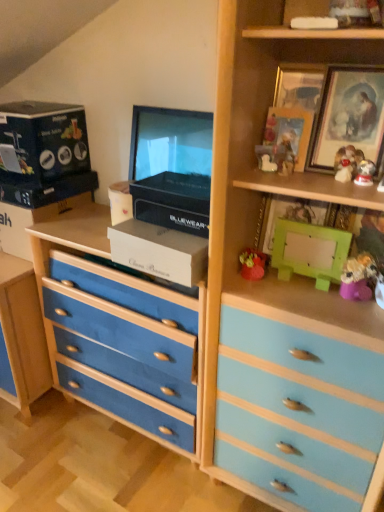
Question: From a real-world perspective, is matte black box at upper left, the fourth box when ordered from right to left, on top of green matte box at upper right, which is counted as the first box, starting from the right?

Choices:
 (A) no
 (B) yes

Answer: (B)

Question: Is matte black box at upper left, the fourth box when ordered from right to left, bigger than green matte box at upper right, which is counted as the fifth box, starting from the left?

Choices:
 (A) yes
 (B) no

Answer: (A)

Question: Is matte black box at upper left, the fourth box when ordered from right to left, next to green matte box at upper right, which is counted as the fifth box, starting from the left, and touching it?

Choices:
 (A) yes
 (B) no

Answer: (B)

Question: Can we say matte black box at upper left, the fourth box when ordered from right to left, lies outside green matte box at upper right, which is counted as the fifth box, starting from the left?

Choices:
 (A) yes
 (B) no

Answer: (A)

Question: Is matte black box at upper left, the fourth box when ordered from right to left, further to camera compared to green matte box at upper right, which is counted as the fifth box, starting from the left?

Choices:
 (A) no
 (B) yes

Answer: (B)

Question: Considering the relative positions of white glossy figurine at upper right, the 2th toy from the left, and wooden picture frame at upper right, which ranks as the second picture frame in right-to-left order, in the image provided, is white glossy figurine at upper right, the 2th toy from the left, to the left or to the right of wooden picture frame at upper right, which ranks as the second picture frame in right-to-left order,?

Choices:
 (A) left
 (B) right

Answer: (B)

Question: From a real-world perspective, is white glossy figurine at upper right, the 2th toy from the left, physically located above or below wooden picture frame at upper right, which ranks as the second picture frame in right-to-left order?

Choices:
 (A) below
 (B) above

Answer: (A)

Question: From the image's perspective, is white glossy figurine at upper right, which is the 1th toy in top-to-bottom order, above or below wooden picture frame at upper right, which is the second picture frame in left-to-right order?

Choices:
 (A) above
 (B) below

Answer: (B)

Question: Is point (342, 166) closer or farther from the camera than point (278, 97)?

Choices:
 (A) farther
 (B) closer

Answer: (B)

Question: Visually, is fuzzy yellow toy at right, positioned as the first toy in right-to-left order, positioned to the left or to the right of wooden framed picture at upper right, the 3th picture frame viewed from the left?

Choices:
 (A) right
 (B) left

Answer: (A)

Question: From a real-world perspective, relative to wooden framed picture at upper right, the first picture frame positioned from the right, is fuzzy yellow toy at right, the fourth toy from the left, vertically above or below?

Choices:
 (A) above
 (B) below

Answer: (B)

Question: From the image's perspective, is fuzzy yellow toy at right, positioned as the first toy in right-to-left order, above or below wooden framed picture at upper right, the 3th picture frame viewed from the left?

Choices:
 (A) above
 (B) below

Answer: (B)

Question: From their relative heights in the image, would you say fuzzy yellow toy at right, the fourth toy from the left, is taller or shorter than wooden framed picture at upper right, the 3th picture frame viewed from the left?

Choices:
 (A) tall
 (B) short

Answer: (B)

Question: From a real-world perspective, is matte red figurine at upper right, the 2th toy in the top-to-bottom sequence, positioned above or below blue fabric chest of drawers at center?

Choices:
 (A) above
 (B) below

Answer: (A)

Question: From the image's perspective, is matte red figurine at upper right, the 2th toy in the top-to-bottom sequence, above or below blue fabric chest of drawers at center?

Choices:
 (A) above
 (B) below

Answer: (A)